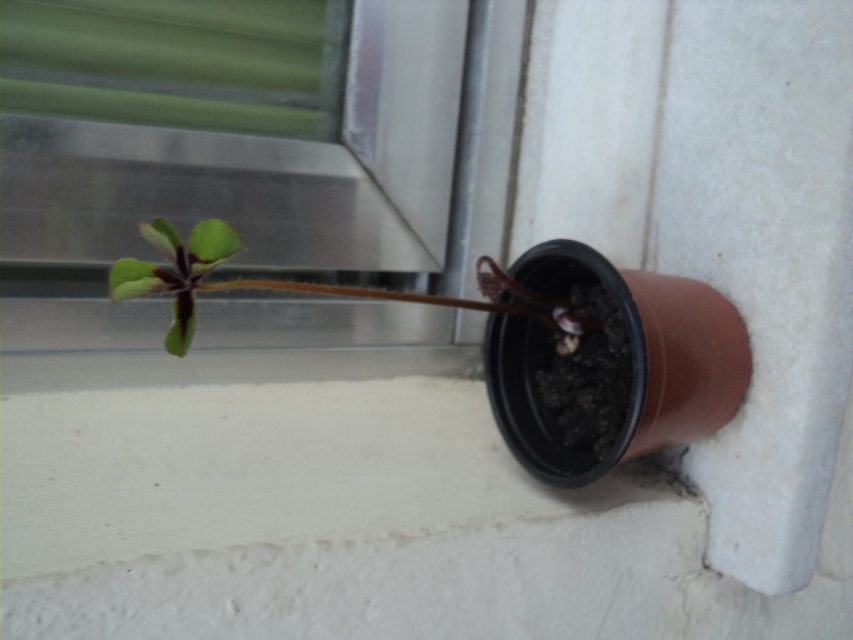
Who is taller, green matte window at upper left or green matte leaf at center?

Standing taller between the two is green matte window at upper left.

Can you confirm if green matte window at upper left is smaller than green matte leaf at center?

Actually, green matte window at upper left might be larger than green matte leaf at center.

You are a GUI agent. You are given a task and a screenshot of the screen. Output one action in this format:
    pyautogui.click(x=<x>, y=<y>)
    Task: Click on the green matte window at upper left
    Image resolution: width=853 pixels, height=640 pixels.
    Given the screenshot: What is the action you would take?
    pyautogui.click(x=236, y=189)